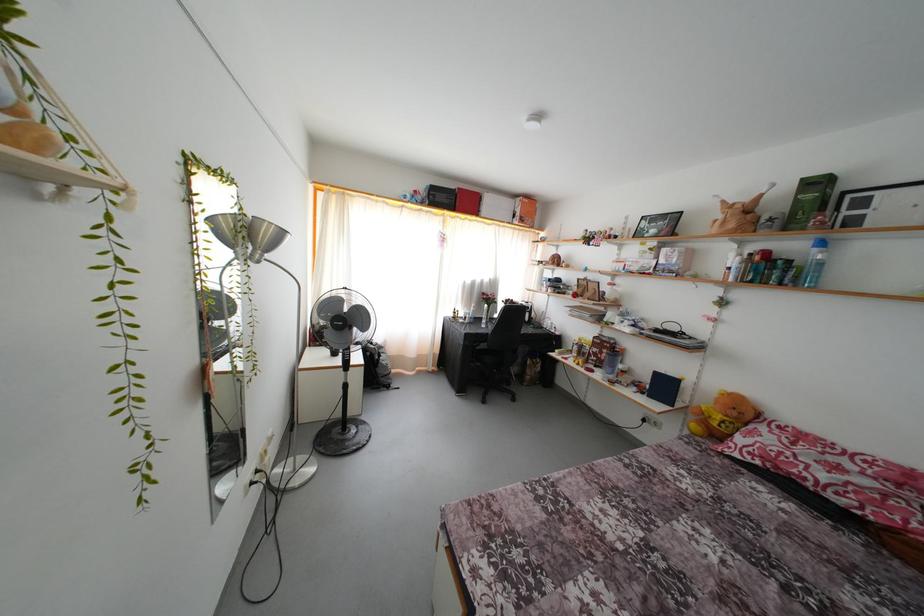
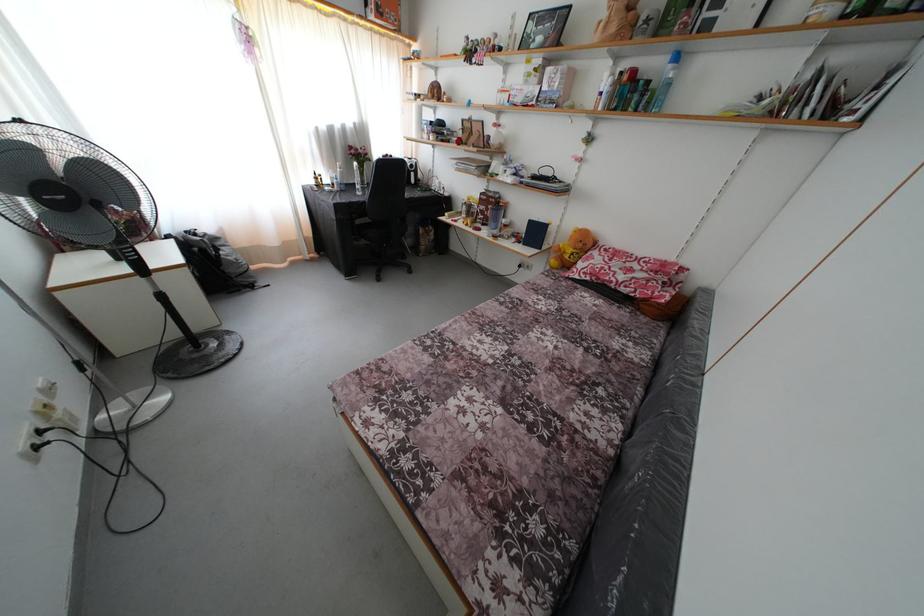
Where in the second image is the point corresponding to point 821,256 from the first image?

(675, 73)